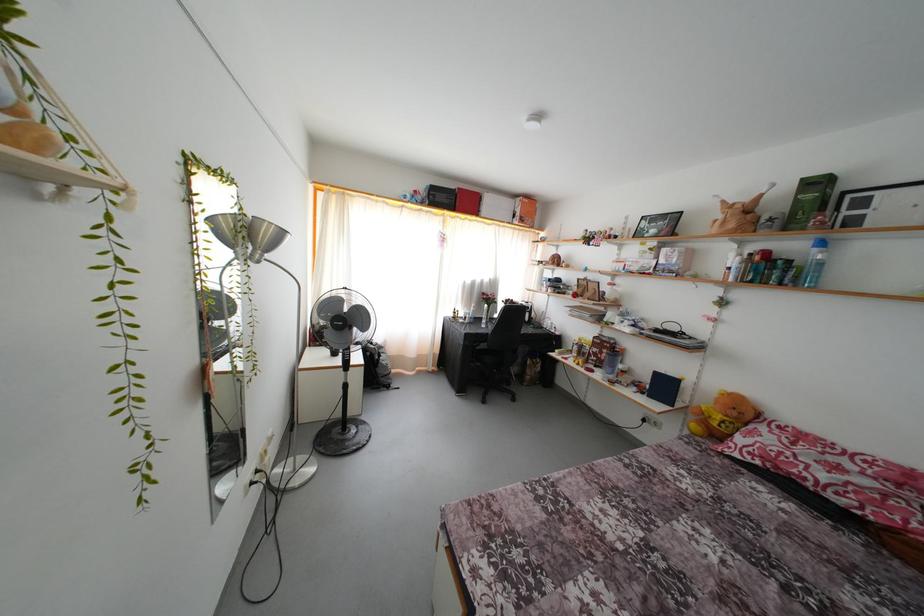
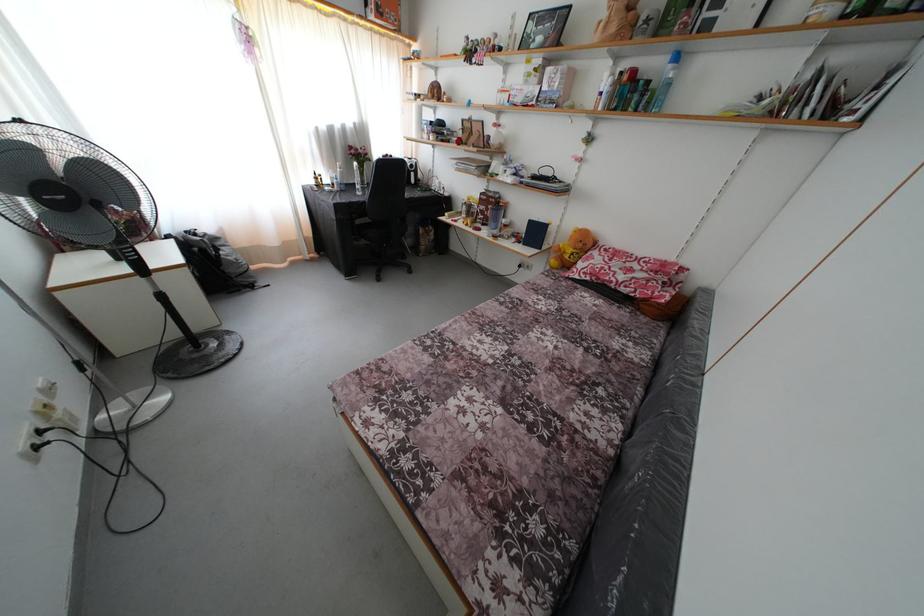
Where in the second image is the point corresponding to point 821,256 from the first image?

(675, 73)